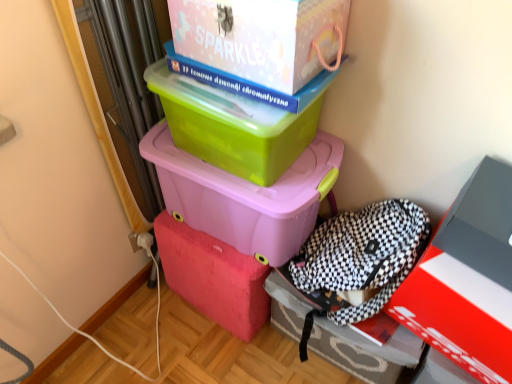
Question: Can you confirm if green plastic box at upper center, which is the second box from top to bottom, is positioned to the right of matte red box at lower right, positioned as the 2th box in bottom-to-top order?

Choices:
 (A) no
 (B) yes

Answer: (A)

Question: Does green plastic box at upper center, which is the second box from top to bottom, come behind matte red box at lower right, placed as the fourth box when sorted from top to bottom?

Choices:
 (A) no
 (B) yes

Answer: (B)

Question: Is green plastic box at upper center, which is the second box from top to bottom, facing towards matte red box at lower right, placed as the fourth box when sorted from top to bottom?

Choices:
 (A) no
 (B) yes

Answer: (A)

Question: Does green plastic box at upper center, which is the second box from top to bottom, appear on the left side of matte red box at lower right, positioned as the 2th box in bottom-to-top order?

Choices:
 (A) yes
 (B) no

Answer: (A)

Question: Can you confirm if green plastic box at upper center, which is counted as the 4th box, starting from the bottom, is wider than matte red box at lower right, placed as the fourth box when sorted from top to bottom?

Choices:
 (A) yes
 (B) no

Answer: (B)

Question: Can you confirm if green plastic box at upper center, which is the second box from top to bottom, is smaller than matte red box at lower right, placed as the fourth box when sorted from top to bottom?

Choices:
 (A) yes
 (B) no

Answer: (A)

Question: Considering the relative positions of matte white cardboard box at upper center, marked as the fifth box in a bottom-to-top arrangement, and matte plastic storage box at center, marked as the third box in a top-to-bottom arrangement, in the image provided, is matte white cardboard box at upper center, marked as the fifth box in a bottom-to-top arrangement, to the right of matte plastic storage box at center, marked as the third box in a top-to-bottom arrangement, from the viewer's perspective?

Choices:
 (A) no
 (B) yes

Answer: (B)

Question: Does matte white cardboard box at upper center, the first box viewed from the top, have a lesser width compared to matte plastic storage box at center, marked as the third box in a top-to-bottom arrangement?

Choices:
 (A) no
 (B) yes

Answer: (B)

Question: Is there a large distance between matte white cardboard box at upper center, marked as the fifth box in a bottom-to-top arrangement, and matte plastic storage box at center, which is the 3th box from bottom to top?

Choices:
 (A) yes
 (B) no

Answer: (B)

Question: Does matte white cardboard box at upper center, the first box viewed from the top, have a lesser height compared to matte plastic storage box at center, which is the 3th box from bottom to top?

Choices:
 (A) yes
 (B) no

Answer: (A)

Question: Considering the relative sizes of matte white cardboard box at upper center, the first box viewed from the top, and matte plastic storage box at center, marked as the third box in a top-to-bottom arrangement, in the image provided, is matte white cardboard box at upper center, the first box viewed from the top, smaller than matte plastic storage box at center, marked as the third box in a top-to-bottom arrangement,?

Choices:
 (A) yes
 (B) no

Answer: (A)

Question: Can you confirm if matte white cardboard box at upper center, marked as the fifth box in a bottom-to-top arrangement, is taller than matte plastic storage box at center, marked as the third box in a top-to-bottom arrangement?

Choices:
 (A) yes
 (B) no

Answer: (B)

Question: From the image's perspective, is checkered fabric backpack at lower right, arranged as the first box when ordered from the bottom, over matte white cardboard box at upper center, the first box viewed from the top?

Choices:
 (A) no
 (B) yes

Answer: (A)